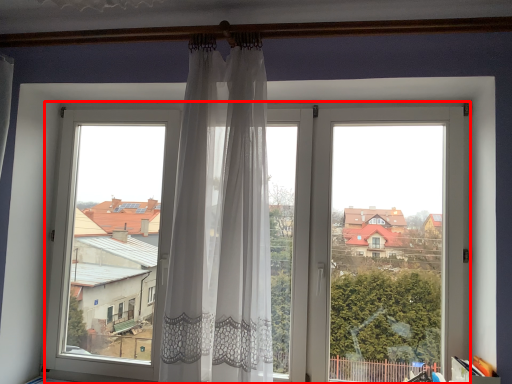
Question: In this image, where is window (annotated by the red box) located relative to curtain?

Choices:
 (A) left
 (B) right

Answer: (B)